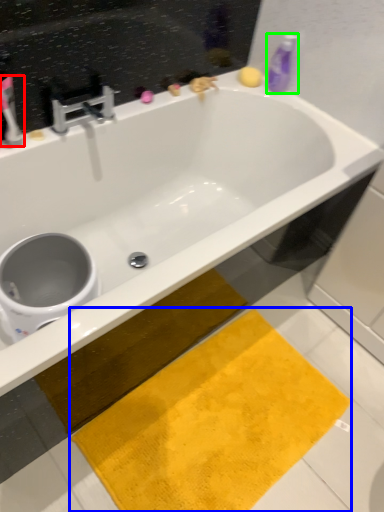
Question: Estimate the real-world distances between objects in this image. Which object is farther from toothbrush (highlighted by a red box), beach towel (highlighted by a blue box) or cleaning product (highlighted by a green box)?

Choices:
 (A) beach towel
 (B) cleaning product

Answer: (A)